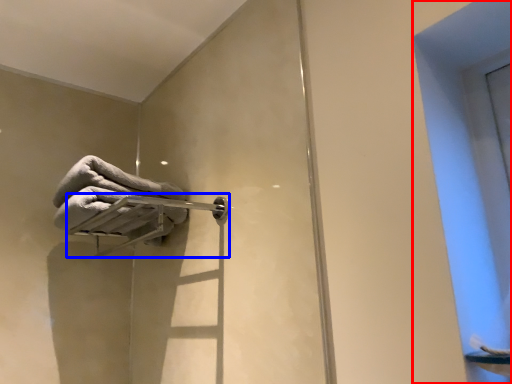
Question: Among these objects, which one is nearest to the camera, window (highlighted by a red box) or towel bar (highlighted by a blue box)?

Choices:
 (A) window
 (B) towel bar

Answer: (A)